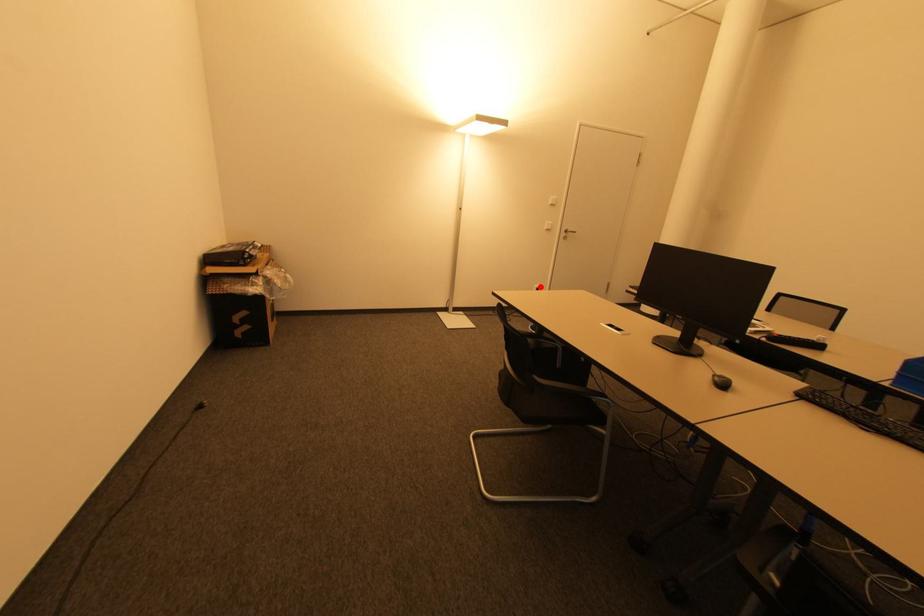
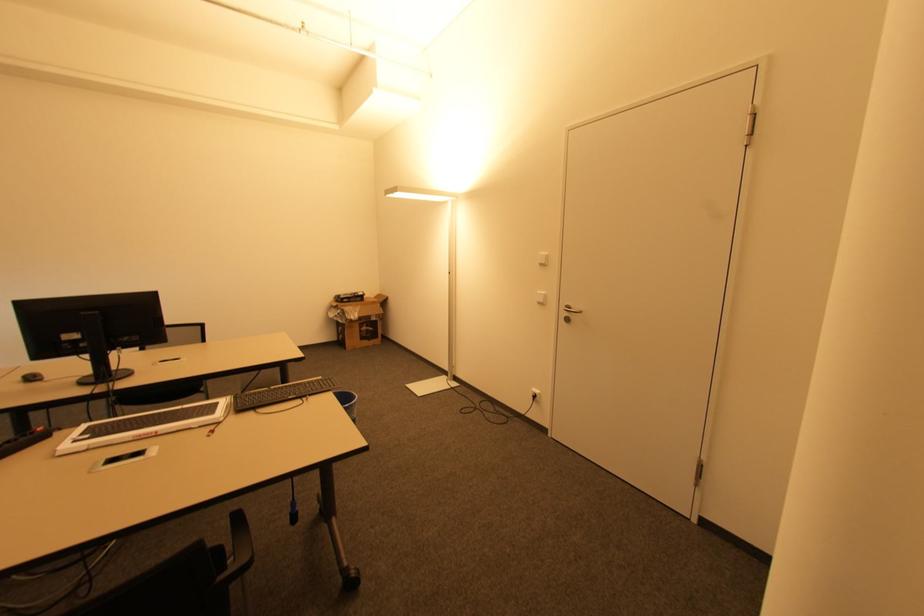
Find the pixel in the second image that matches the highlighted location in the first image.

(539, 392)